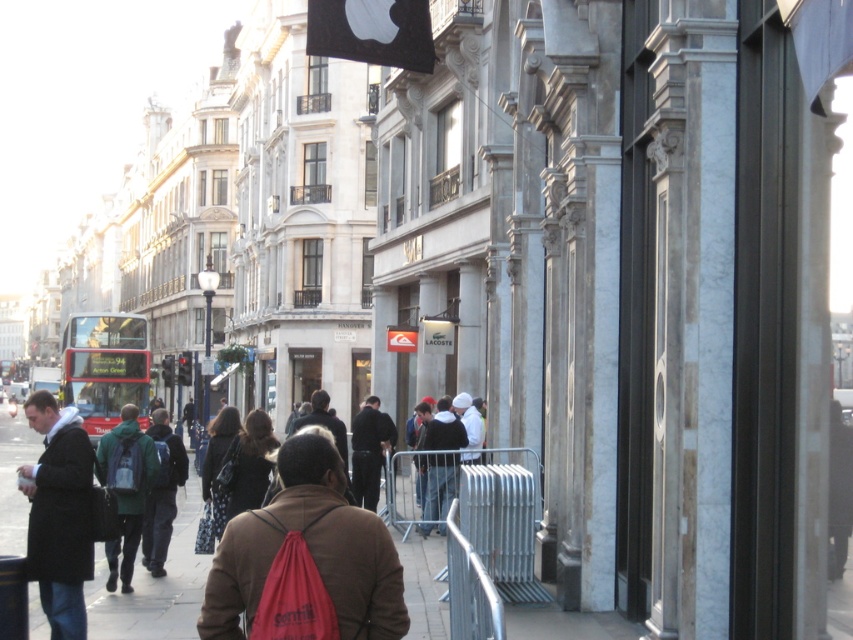
Is point (469, 452) closer to camera compared to point (20, 480)?

No, it is behind (20, 480).

Based on the photo, does galvanized metal barrier at center lie in front of dark brown leather coat at lower left?

No.

Locate an element on the screen. Image resolution: width=853 pixels, height=640 pixels. galvanized metal barrier at center is located at coordinates (480, 508).

Is galvanized metal barrier at center wider than green backpack at center?

Correct, the width of galvanized metal barrier at center exceeds that of green backpack at center.

From the picture: Is galvanized metal barrier at center thinner than green backpack at center?

No, galvanized metal barrier at center is not thinner than green backpack at center.

Which is in front, point (500, 556) or point (100, 444)?

Point (500, 556) is more forward.

This screenshot has width=853, height=640. Find the location of `galvanized metal barrier at center`. galvanized metal barrier at center is located at coordinates (480, 508).

Can you confirm if dark brown leather coat at lower left is wider than green fabric backpack at center?

Indeed, dark brown leather coat at lower left has a greater width compared to green fabric backpack at center.

Which is above, dark brown leather coat at lower left or green fabric backpack at center?

green fabric backpack at center is higher up.

This screenshot has height=640, width=853. What are the coordinates of `dark brown leather coat at lower left` in the screenshot? It's located at (59, 513).